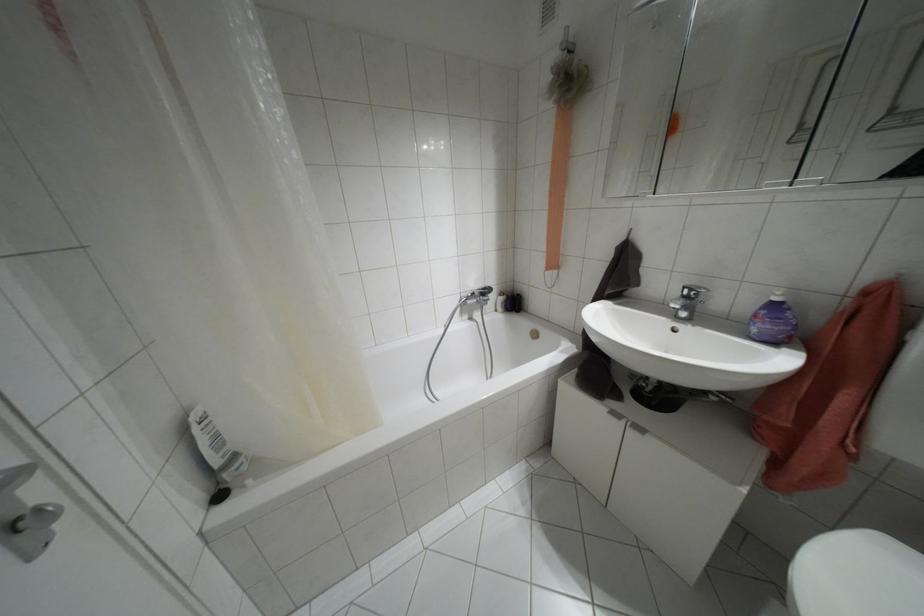
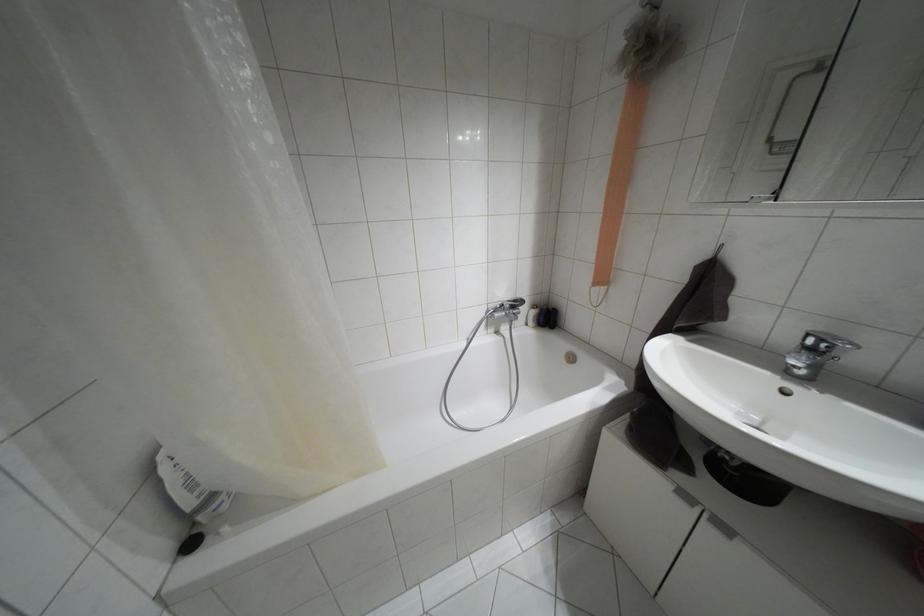
In the second image, find the point that corresponds to [638,429] in the first image.

(723, 528)